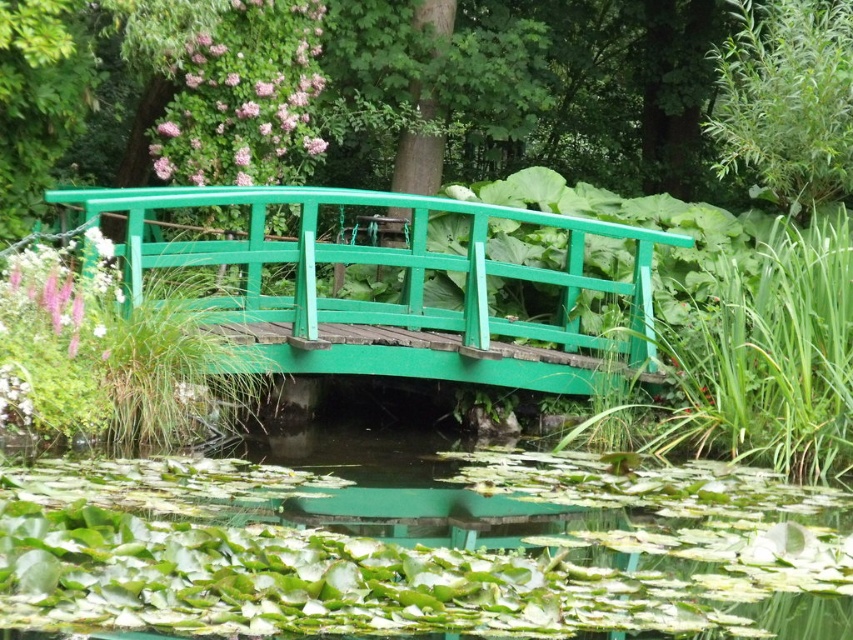
Does green lily pads at center have a larger size compared to green wooden bridge at center?

Actually, green lily pads at center might be smaller than green wooden bridge at center.

Between green lily pads at center and green wooden bridge at center, which one appears on the right side from the viewer's perspective?

green lily pads at center

Describe the element at coordinates (422, 548) in the screenshot. I see `green lily pads at center` at that location.

Identify the location of green lily pads at center. (422, 548).